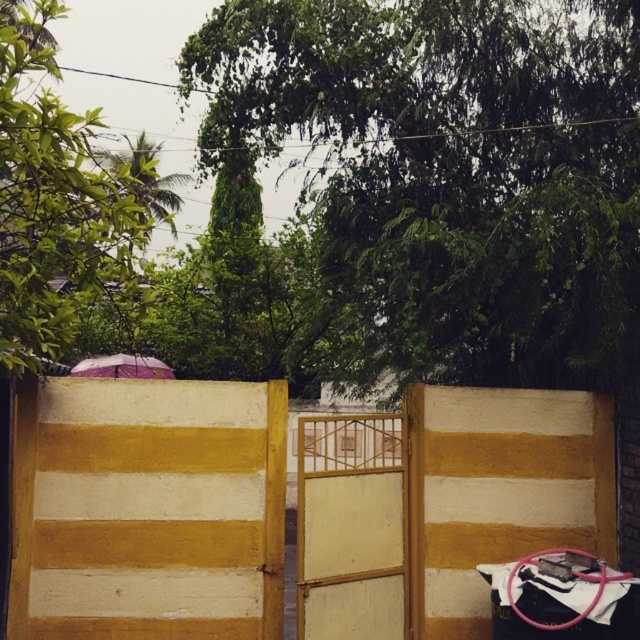
Is wooden gate at center to the right of pink fabric umbrella at upper center from the viewer's perspective?

Indeed, wooden gate at center is positioned on the right side of pink fabric umbrella at upper center.

The image size is (640, 640). I want to click on wooden gate at center, so click(x=352, y=528).